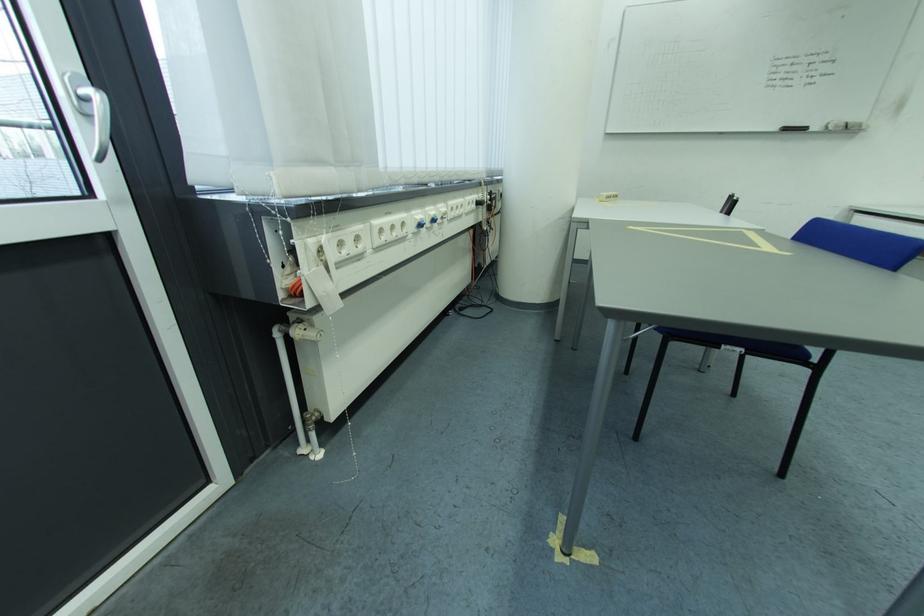
This screenshot has height=616, width=924. In order to click on whiteboard eraser in this screenshot , I will do `click(794, 128)`.